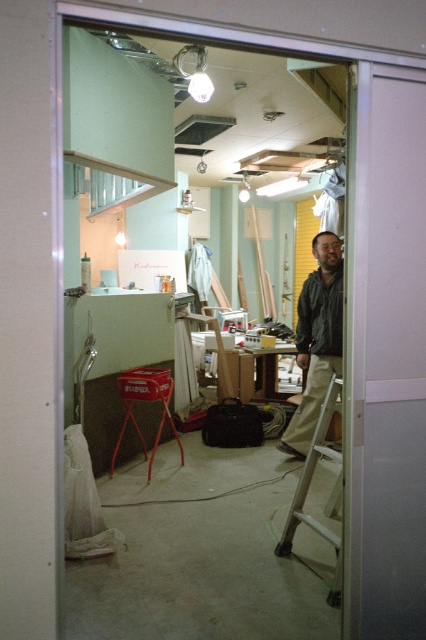
You are standing in the doorway of the workshop and see both the dark green jacket at center and the metallic silver ladder at center. Which object is closer to you?

The dark green jacket at center is closer to you because it is further to the viewer than the metallic silver ladder at center.

Looking at this image, you are moving a large piece of equipment that is 1.2 meters wide. You need to pass through the transparent glass door at center and navigate around the metallic silver ladder at center. Based on their widths, which object will be easier to maneuver around?

The transparent glass door at center is thinner than the metallic silver ladder at center, so it will be easier to maneuver around the transparent glass door at center since it has a narrower width compared to the ladder.